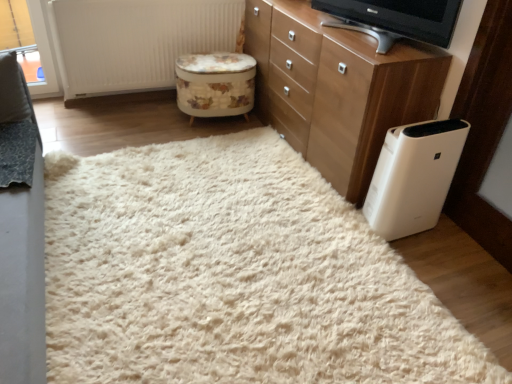
Question: From a real-world perspective, does matte black television at upper center stand above wooden chest of drawers at upper right?

Choices:
 (A) no
 (B) yes

Answer: (B)

Question: Is matte black television at upper center further to the viewer compared to wooden chest of drawers at upper right?

Choices:
 (A) no
 (B) yes

Answer: (A)

Question: Does matte black television at upper center turn towards wooden chest of drawers at upper right?

Choices:
 (A) yes
 (B) no

Answer: (B)

Question: Is the surface of matte black television at upper center in direct contact with wooden chest of drawers at upper right?

Choices:
 (A) no
 (B) yes

Answer: (A)

Question: Does matte black television at upper center have a smaller size compared to wooden chest of drawers at upper right?

Choices:
 (A) yes
 (B) no

Answer: (A)

Question: Considering the positions of floral fabric ottoman at center and white textured radiator at upper center in the image, is floral fabric ottoman at center bigger or smaller than white textured radiator at upper center?

Choices:
 (A) big
 (B) small

Answer: (B)

Question: From the image's perspective, is floral fabric ottoman at center above or below white textured radiator at upper center?

Choices:
 (A) above
 (B) below

Answer: (B)

Question: Based on their positions, is floral fabric ottoman at center located to the left or right of white textured radiator at upper center?

Choices:
 (A) right
 (B) left

Answer: (A)

Question: In the image, is floral fabric ottoman at center positioned in front of or behind white textured radiator at upper center?

Choices:
 (A) behind
 (B) front

Answer: (A)

Question: From the image's perspective, is white plastic air purifier at lower right positioned above or below white textured radiator at upper center?

Choices:
 (A) below
 (B) above

Answer: (A)

Question: From a real-world perspective, is white plastic air purifier at lower right physically located above or below white textured radiator at upper center?

Choices:
 (A) above
 (B) below

Answer: (B)

Question: In terms of height, does white plastic air purifier at lower right look taller or shorter compared to white textured radiator at upper center?

Choices:
 (A) short
 (B) tall

Answer: (A)

Question: Based on their sizes in the image, would you say white plastic air purifier at lower right is bigger or smaller than white textured radiator at upper center?

Choices:
 (A) small
 (B) big

Answer: (A)

Question: Considering the positions of wooden chest of drawers at upper right and matte black television at upper center in the image, is wooden chest of drawers at upper right taller or shorter than matte black television at upper center?

Choices:
 (A) tall
 (B) short

Answer: (A)

Question: Which is correct: wooden chest of drawers at upper right is inside matte black television at upper center, or outside of it?

Choices:
 (A) outside
 (B) inside

Answer: (A)